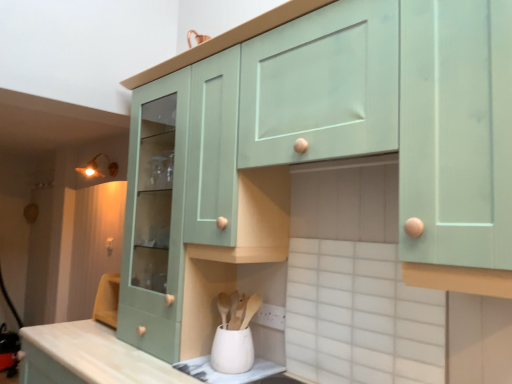
Question: In the image, is matte brass light fixture at upper left on the left side or the right side of white ceramic tile at lower center?

Choices:
 (A) right
 (B) left

Answer: (B)

Question: Considering the positions of matte brass light fixture at upper left and white ceramic tile at lower center in the image, is matte brass light fixture at upper left wider or thinner than white ceramic tile at lower center?

Choices:
 (A) wide
 (B) thin

Answer: (A)

Question: Estimate the real-world distances between objects in this image. Which object is closer to the mint green wood cabinet at center, positioned as the second cabinetry in right-to-left order?

Choices:
 (A) white matte utensil holder at lower center
 (B) white ceramic tile at lower center
 (C) mint green wood cabinet at upper center, the second cabinetry viewed from the left
 (D) matte brass light fixture at upper left

Answer: (C)

Question: Estimate the real-world distances between objects in this image. Which object is closer to the matte brass light fixture at upper left?

Choices:
 (A) white matte utensil holder at lower center
 (B) mint green wood cabinet at center, positioned as the second cabinetry in right-to-left order
 (C) mint green wood cabinet at upper center, acting as the 1th cabinetry starting from the right
 (D) white ceramic tile at lower center

Answer: (B)